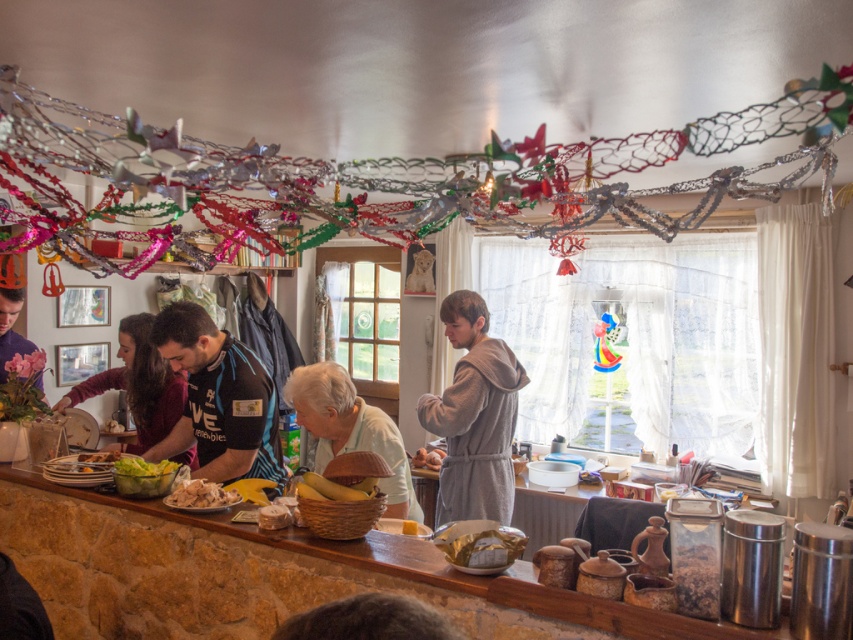
You are a guest at a festive gathering and notice the gray plush robe at center and the smooth brown bread at lower left on the counter. Which item is covering the other?

The gray plush robe at center is positioned over smooth brown bread at lower left, so it is covering the bread.

You are a chef preparing a meal and need to reach both the dark blue jersey at center and the smooth brown bread at lower left. If you can only move 15 inches forward from your current position, can you reach both items without moving further?

The dark blue jersey at center is 15.97 inches away from the smooth brown bread at lower left. Since the distance between them is slightly more than 15 inches, you cannot reach both items without moving further.

You are a guest in this festive kitchen and want to grab a banana from the yellow matte bananas at center. However, there is a gray plush robe at center in the way. Can you easily reach the bananas without moving the robe?

The gray plush robe at center is much taller than the yellow matte bananas at center, so it might block your view or access. You might need to move the robe to reach the bananas.